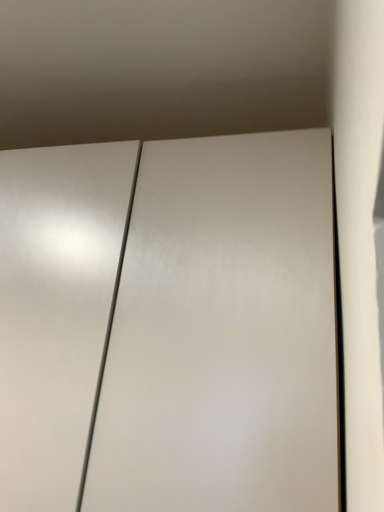
Where is `satin white cupboard at upper center`? The height and width of the screenshot is (512, 384). satin white cupboard at upper center is located at coordinates (169, 325).

What is the approximate width of satin white cupboard at upper center?

satin white cupboard at upper center is 35.26 centimeters wide.

The width and height of the screenshot is (384, 512). What do you see at coordinates (169, 325) in the screenshot?
I see `satin white cupboard at upper center` at bounding box center [169, 325].

Measure the distance between satin white cupboard at upper center and camera.

satin white cupboard at upper center is 20.99 inches from camera.

Find the location of a particular element. This screenshot has width=384, height=512. satin white cupboard at upper center is located at coordinates (169, 325).